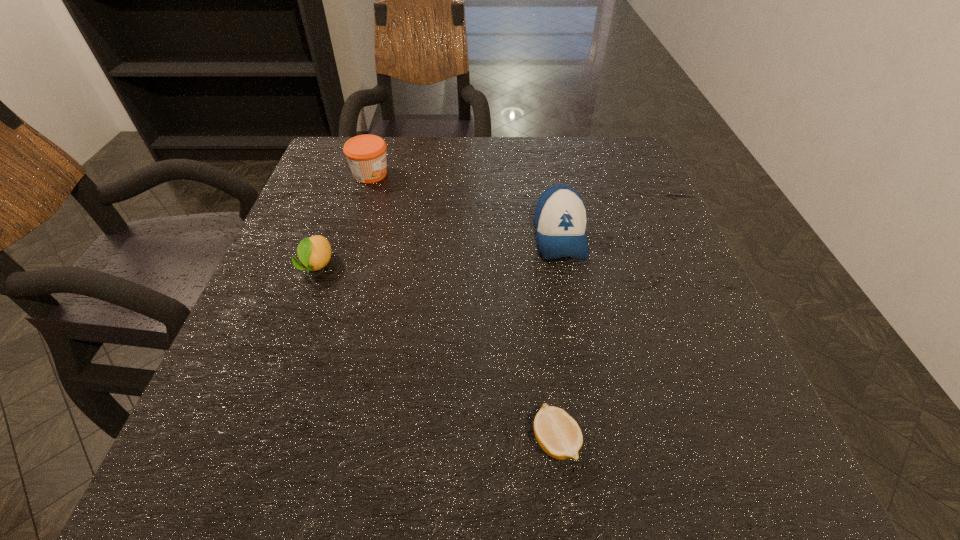
Find the location of a particular element. The height and width of the screenshot is (540, 960). vacant area that lies between the baseball cap and the farther lemon is located at coordinates (439, 251).

The image size is (960, 540). Find the location of `the closest object to the right lemon`. the closest object to the right lemon is located at coordinates (560, 218).

Where is `object identified as the second closest to the farther lemon`? object identified as the second closest to the farther lemon is located at coordinates (560, 218).

This screenshot has width=960, height=540. Find the location of `vacant area that satisfies the following two spatial constraints: 1. with leaves positioned above the left lemon; 2. on the right side of the shortest object`. vacant area that satisfies the following two spatial constraints: 1. with leaves positioned above the left lemon; 2. on the right side of the shortest object is located at coordinates (252, 441).

Locate an element on the screen. vacant space that satisfies the following two spatial constraints: 1. on the back side of the nearer lemon; 2. on the front label of the jam is located at coordinates (523, 174).

Identify the location of free space that satisfies the following two spatial constraints: 1. with leaves positioned above the nearest object; 2. on the right side of the third tallest object. (252, 441).

Where is `vacant space that satisfies the following two spatial constraints: 1. on the front label of the farthest object; 2. with leaves positioned above the taller lemon`? The image size is (960, 540). vacant space that satisfies the following two spatial constraints: 1. on the front label of the farthest object; 2. with leaves positioned above the taller lemon is located at coordinates (342, 266).